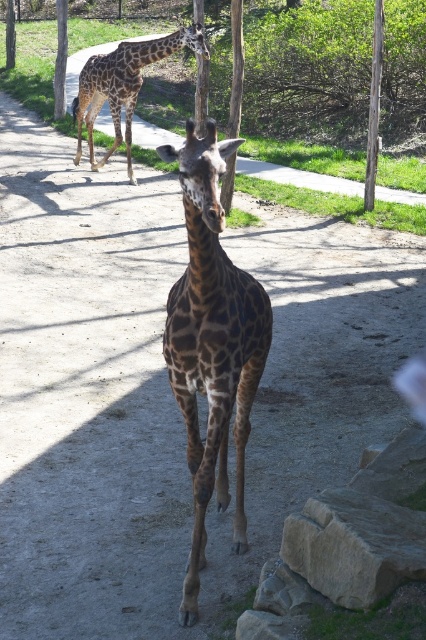
Consider the image. You are a zookeeper observing two giraffes in the enclosure. You need to determine which giraffe has a thinner body. The giraffes are the spotted fur giraffe at center and the brown spotted giraffe at upper left. Which one is thinner?

The spotted fur giraffe at center is thinner than the brown spotted giraffe at upper left.